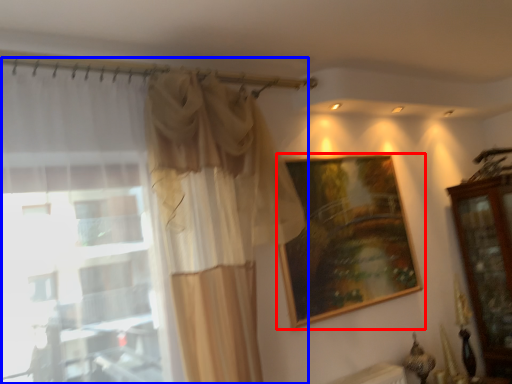
Question: Which point is closer to the camera, picture frame (highlighted by a red box) or curtain (highlighted by a blue box)?

Choices:
 (A) picture frame
 (B) curtain

Answer: (B)